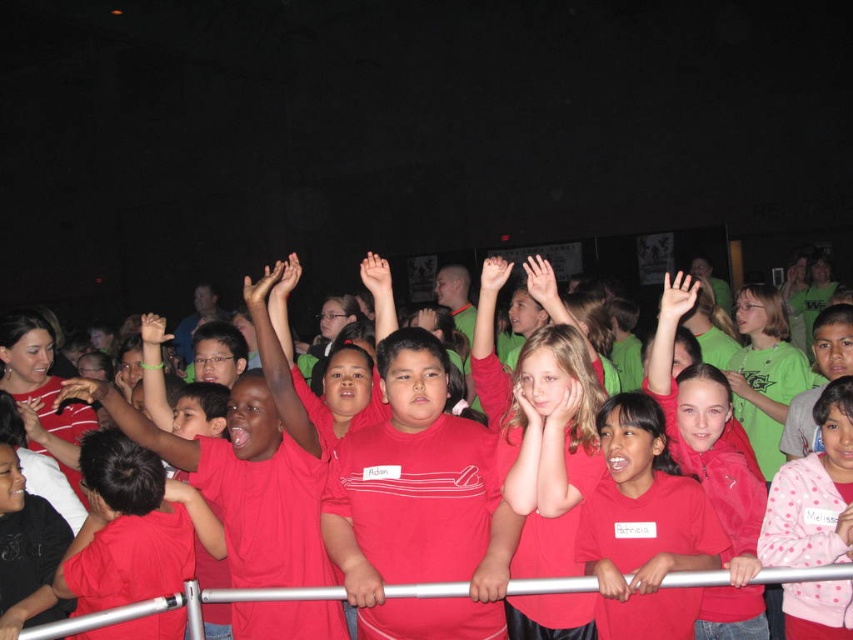
Can you confirm if matte red shirts at center is taller than matte red shirt at center?

In fact, matte red shirts at center may be shorter than matte red shirt at center.

Between matte red shirts at center and matte red shirt at center, which one appears on the left side from the viewer's perspective?

matte red shirts at center is more to the left.

The image size is (853, 640). I want to click on matte red shirts at center, so click(165, 388).

Who is shorter, matte red shirts at center or silver metallic rail at center?

With less height is silver metallic rail at center.

Does matte red shirts at center appear on the left side of silver metallic rail at center?

Incorrect, matte red shirts at center is not on the left side of silver metallic rail at center.

Who is more distant from viewer, (584, 333) or (164, 609)?

The point (584, 333) is more distant.

Find the location of a particular element. The width and height of the screenshot is (853, 640). matte red shirts at center is located at coordinates (165, 388).

Which is behind, point (670, 490) or point (393, 593)?

Positioned behind is point (670, 490).

Which is above, matte red shirt at center or silver metallic rail at center?

matte red shirt at center is above.

Where is `matte red shirt at center`? Image resolution: width=853 pixels, height=640 pixels. matte red shirt at center is located at coordinates (643, 528).

Find the location of a particular element. Image resolution: width=853 pixels, height=640 pixels. matte red shirt at center is located at coordinates (643, 528).